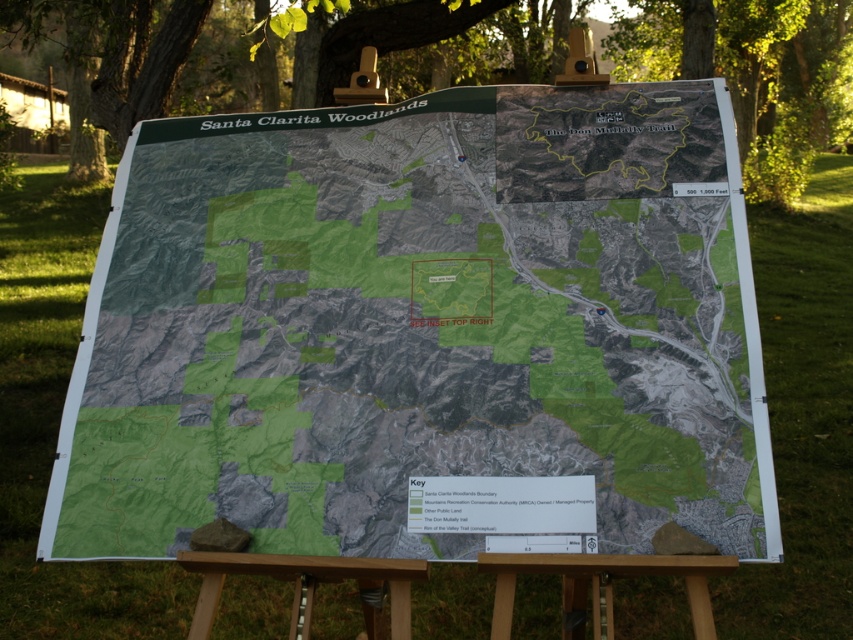
Question: Is green textured map at center above green leafy tree at upper center?

Choices:
 (A) no
 (B) yes

Answer: (A)

Question: Is green textured map at center below green leafy tree at upper center?

Choices:
 (A) no
 (B) yes

Answer: (B)

Question: Is green textured map at center to the left of green leafy tree at upper center from the viewer's perspective?

Choices:
 (A) yes
 (B) no

Answer: (A)